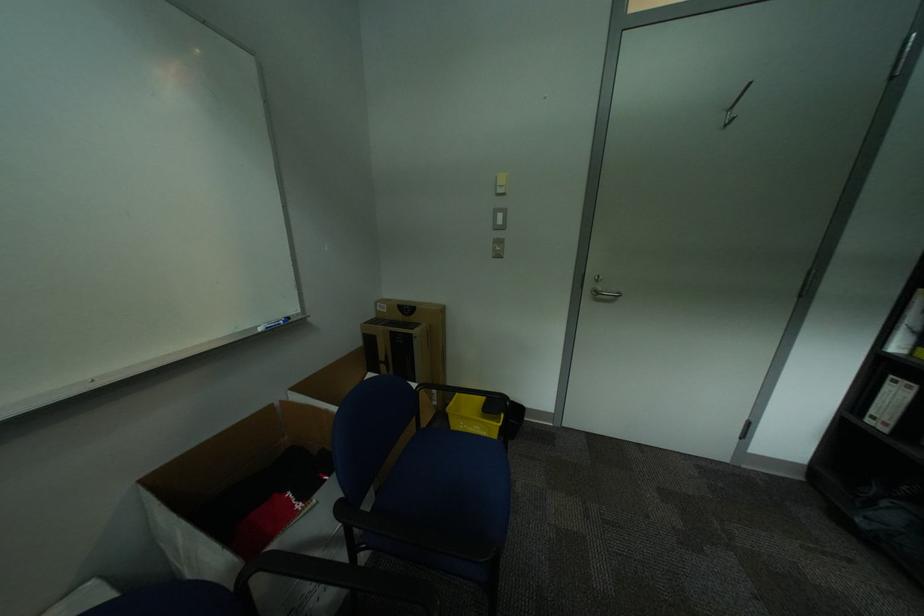
Find the location of a particular element. The image size is (924, 616). black chair armrest is located at coordinates 440,398.